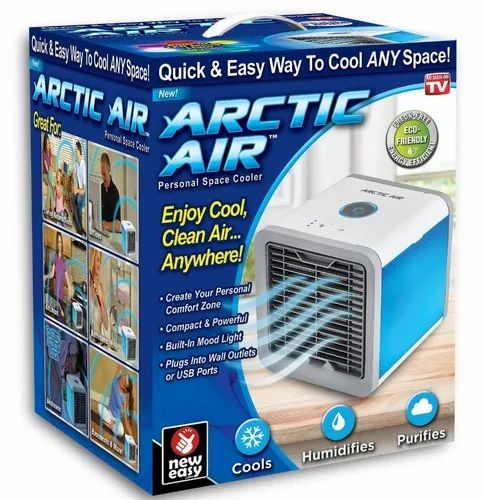
This screenshot has height=500, width=482. Identify the location of handle. (242, 19).